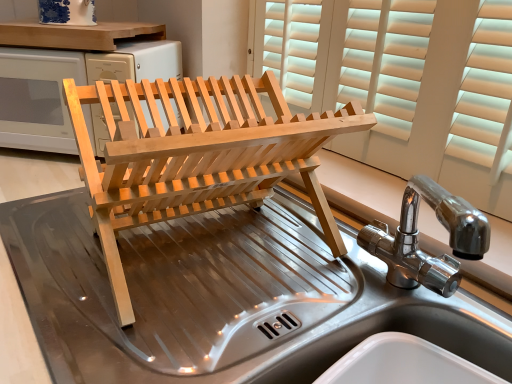
Where is `blank area beneath polished stainless steel sink at center, placed as the 1th sink when sorted from top to bottom (from a real-world perspective)`? This screenshot has height=384, width=512. blank area beneath polished stainless steel sink at center, placed as the 1th sink when sorted from top to bottom (from a real-world perspective) is located at coordinates (407, 302).